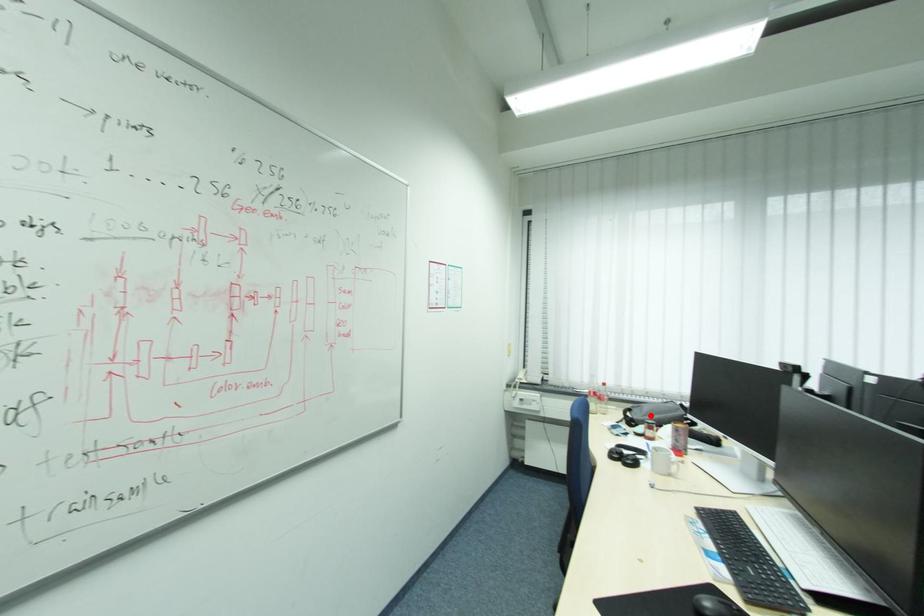
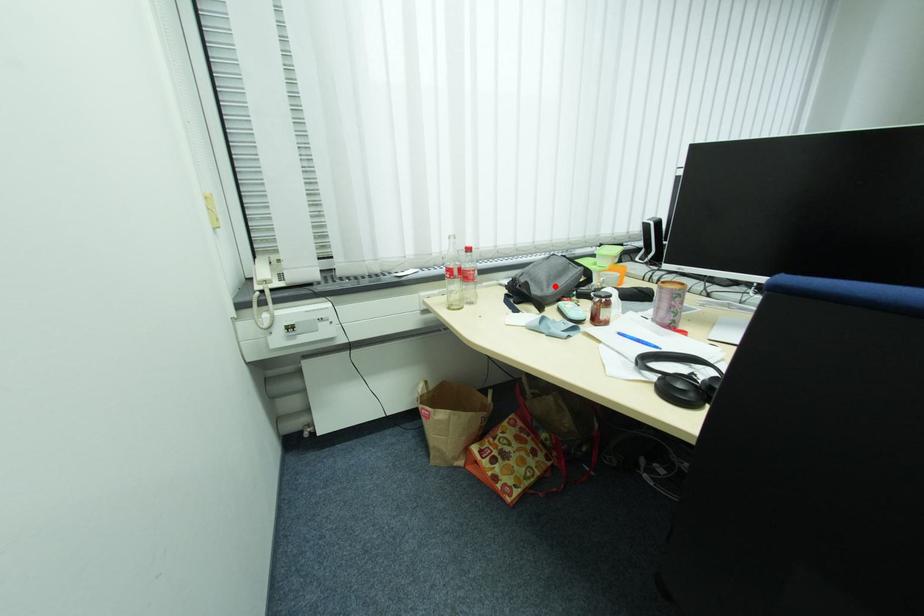
I am providing you with two images of the same scene from different viewpoints. A red point is marked on the first image and another point is marked on the second image. Is the marked point in image1 the same physical position as the marked point in image2?

Yes